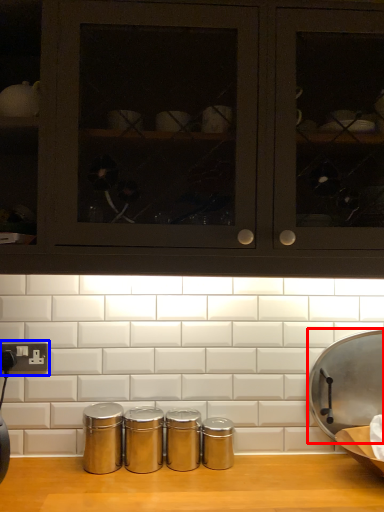
Question: Among these objects, which one is farthest to the camera, wide (highlighted by a red box) or electric outlet (highlighted by a blue box)?

Choices:
 (A) wide
 (B) electric outlet

Answer: (B)